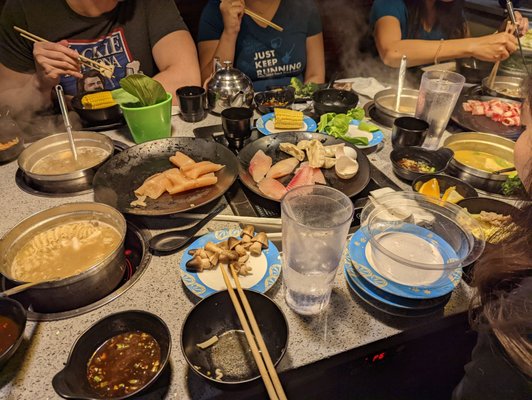
Locate an element on the screen. The image size is (532, 400). spout of teapot is located at coordinates tap(239, 95).